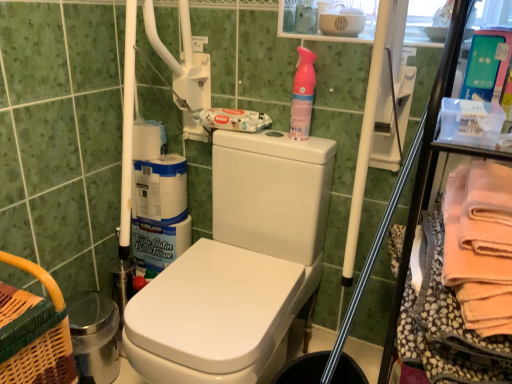
What is the approximate height of soft peach towel at right?

The height of soft peach towel at right is 12.16 inches.

Image resolution: width=512 pixels, height=384 pixels. What do you see at coordinates (464, 282) in the screenshot?
I see `soft peach towel at right` at bounding box center [464, 282].

Measure the distance between soft peach towel at right and camera.

soft peach towel at right is 24.24 inches away from camera.

Image resolution: width=512 pixels, height=384 pixels. What are the coordinates of `soft peach towel at right` in the screenshot? It's located at (464, 282).

This screenshot has height=384, width=512. What do you see at coordinates (302, 95) in the screenshot?
I see `pink plastic spray bottle at upper right` at bounding box center [302, 95].

You are a GUI agent. You are given a task and a screenshot of the screen. Output one action in this format:
    pyautogui.click(x=<x>, y=<y>)
    Task: Click on the pink plastic spray bottle at upper right
    The width and height of the screenshot is (512, 384).
    Given the screenshot: What is the action you would take?
    pyautogui.click(x=302, y=95)

This screenshot has height=384, width=512. What are the coordinates of `soft peach towel at right` in the screenshot? It's located at (464, 282).

Is soft peach towel at right to the left or to the right of pink plastic spray bottle at upper right in the image?

From the image, it's evident that soft peach towel at right is to the right of pink plastic spray bottle at upper right.

Considering their positions, is soft peach towel at right located in front of or behind pink plastic spray bottle at upper right?

Clearly, soft peach towel at right is in front of pink plastic spray bottle at upper right.

Is point (451, 271) positioned behind point (301, 134)?

No, it is not.

From the image's perspective, which one is positioned higher, soft peach towel at right or pink plastic spray bottle at upper right?

From the image's view, pink plastic spray bottle at upper right is above.

Based on the photo, from a real-world perspective, relative to pink plastic spray bottle at upper right, is soft peach towel at right vertically above or below?

In terms of real-world spatial position, soft peach towel at right is below pink plastic spray bottle at upper right.

Between soft peach towel at right and pink plastic spray bottle at upper right, which one has smaller width?

With smaller width is pink plastic spray bottle at upper right.

Who is shorter, soft peach towel at right or pink plastic spray bottle at upper right?

Standing shorter between the two is pink plastic spray bottle at upper right.

Consider the image. Considering the relative sizes of soft peach towel at right and pink plastic spray bottle at upper right in the image provided, is soft peach towel at right bigger than pink plastic spray bottle at upper right?

Yes.

From the picture: Is soft peach towel at right outside of pink plastic spray bottle at upper right?

Yes, soft peach towel at right is not within pink plastic spray bottle at upper right.

Is soft peach towel at right directly adjacent to pink plastic spray bottle at upper right?

No, soft peach towel at right is not next to pink plastic spray bottle at upper right.

Is soft peach towel at right facing away from pink plastic spray bottle at upper right?

No, soft peach towel at right is not facing the opposite direction of pink plastic spray bottle at upper right.

How many degrees apart are the facing directions of soft peach towel at right and pink plastic spray bottle at upper right?

2.43 degrees.

The width and height of the screenshot is (512, 384). What are the coordinates of `cleaning product on the left of soft peach towel at right` in the screenshot? It's located at (302, 95).

Between pink plastic spray bottle at upper right and soft peach towel at right, which one appears on the left side from the viewer's perspective?

pink plastic spray bottle at upper right.

Which object is further away from the camera, pink plastic spray bottle at upper right or soft peach towel at right?

pink plastic spray bottle at upper right is further from the camera.

Considering the positions of point (311, 92) and point (454, 379), is point (311, 92) closer or farther from the camera than point (454, 379)?

Clearly, point (311, 92) is more distant from the camera than point (454, 379).

From the image's perspective, which is above, pink plastic spray bottle at upper right or soft peach towel at right?

From the image's view, pink plastic spray bottle at upper right is above.

Looking at this image, from a real-world perspective, which is physically below, pink plastic spray bottle at upper right or soft peach towel at right?

soft peach towel at right.

Does pink plastic spray bottle at upper right have a lesser width compared to soft peach towel at right?

Correct, the width of pink plastic spray bottle at upper right is less than that of soft peach towel at right.

Is pink plastic spray bottle at upper right taller than soft peach towel at right?

No, pink plastic spray bottle at upper right is not taller than soft peach towel at right.

Looking at the image, does pink plastic spray bottle at upper right seem bigger or smaller compared to soft peach towel at right?

Clearly, pink plastic spray bottle at upper right is smaller in size than soft peach towel at right.

Is pink plastic spray bottle at upper right inside the boundaries of soft peach towel at right, or outside?

pink plastic spray bottle at upper right is spatially situated outside soft peach towel at right.

Is pink plastic spray bottle at upper right far from soft peach towel at right?

pink plastic spray bottle at upper right is near soft peach towel at right, not far away.

Is pink plastic spray bottle at upper right positioned with its back to soft peach towel at right?

No, pink plastic spray bottle at upper right is not facing the opposite direction of soft peach towel at right.

Consider the image. Can you tell me how much pink plastic spray bottle at upper right and soft peach towel at right differ in facing direction?

The angle between the facing direction of pink plastic spray bottle at upper right and the facing direction of soft peach towel at right is 2.43 degrees.

You are a GUI agent. You are given a task and a screenshot of the screen. Output one action in this format:
    pyautogui.click(x=<x>, y=<y>)
    Task: Click on the cleaning product on the left side of soft peach towel at right
    The width and height of the screenshot is (512, 384).
    Given the screenshot: What is the action you would take?
    302,95

Identify the location of material that is on the right side of pink plastic spray bottle at upper right. (464, 282).

Where is `material that is in front of the pink plastic spray bottle at upper right`? The height and width of the screenshot is (384, 512). material that is in front of the pink plastic spray bottle at upper right is located at coordinates (464, 282).